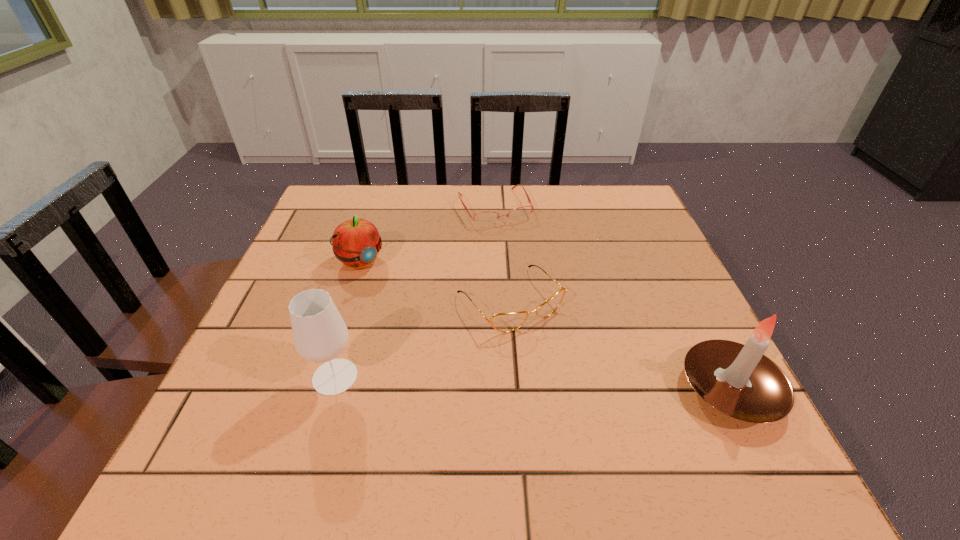
Where is `empty space between the nearer spectacles and the candle`? Image resolution: width=960 pixels, height=540 pixels. empty space between the nearer spectacles and the candle is located at coordinates (620, 345).

This screenshot has width=960, height=540. Find the location of `object that is the second closest one to the candle`. object that is the second closest one to the candle is located at coordinates (483, 218).

Select which object appears as the third closest to the nearer spectacles. Please provide its 2D coordinates. Your answer should be formatted as a tuple, i.e. [(x, y)], where the tuple contains the x and y coordinates of a point satisfying the conditions above.

[(356, 242)]

The height and width of the screenshot is (540, 960). Find the location of `vacant space that satisfies the following two spatial constraints: 1. on the front side of the glass; 2. on the left side of the third shortest object`. vacant space that satisfies the following two spatial constraints: 1. on the front side of the glass; 2. on the left side of the third shortest object is located at coordinates (324, 377).

Locate an element on the screen. The image size is (960, 540). vacant space that satisfies the following two spatial constraints: 1. on the front side of the farthest object; 2. on the right side of the rightmost object is located at coordinates click(x=503, y=389).